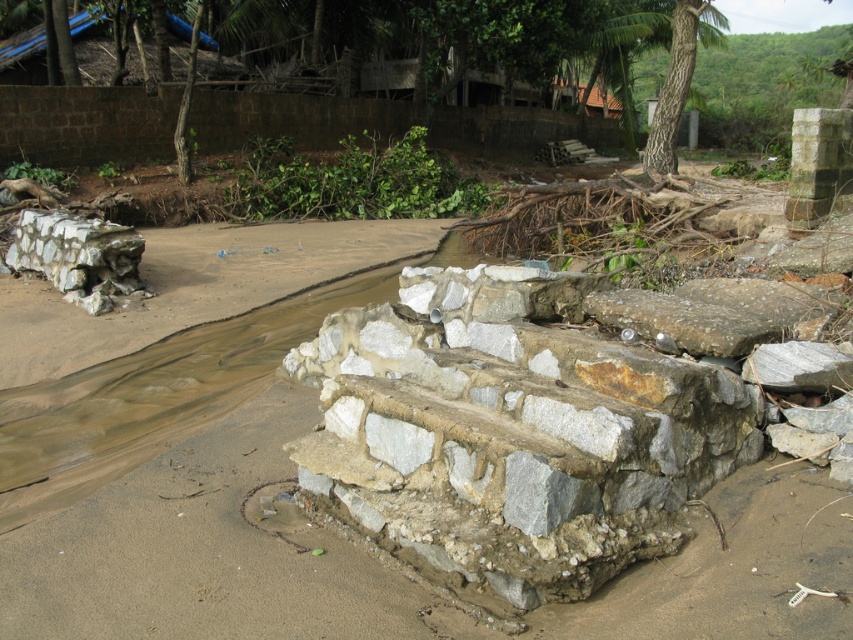
You are standing at the origin point of the image. Which direction should you move to reach the brown sandy dirt track at center?

The brown sandy dirt track at center is located at point 0.863 on the x axis and 0.242 on the y axis, so you should move towards the right and slightly upwards to reach it.

You are a hiker trying to cross the stream. You see the gray stone steps at center and the gray stone wall at left. Which structure is larger in size?

The gray stone steps at center is bigger than the gray stone wall at left, so the gray stone steps at center is the larger structure.